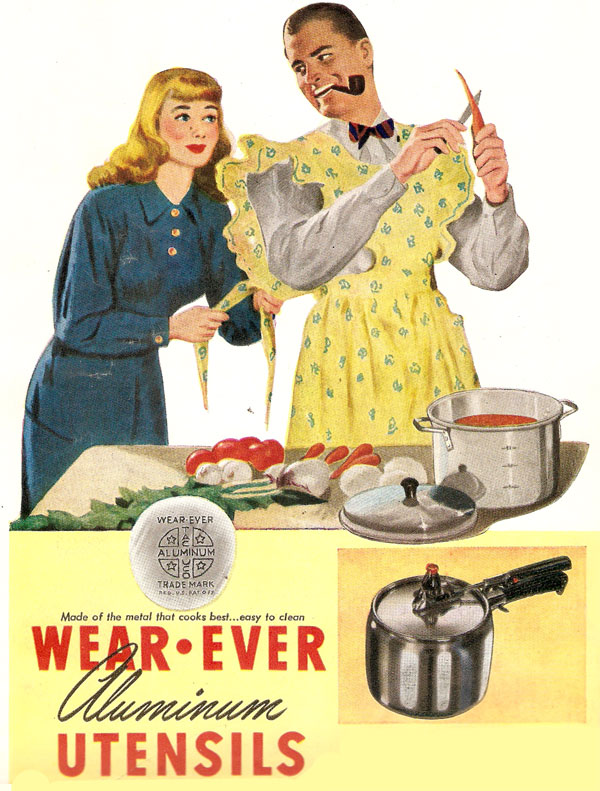
Identify the location of pot. (436, 672), (499, 464).